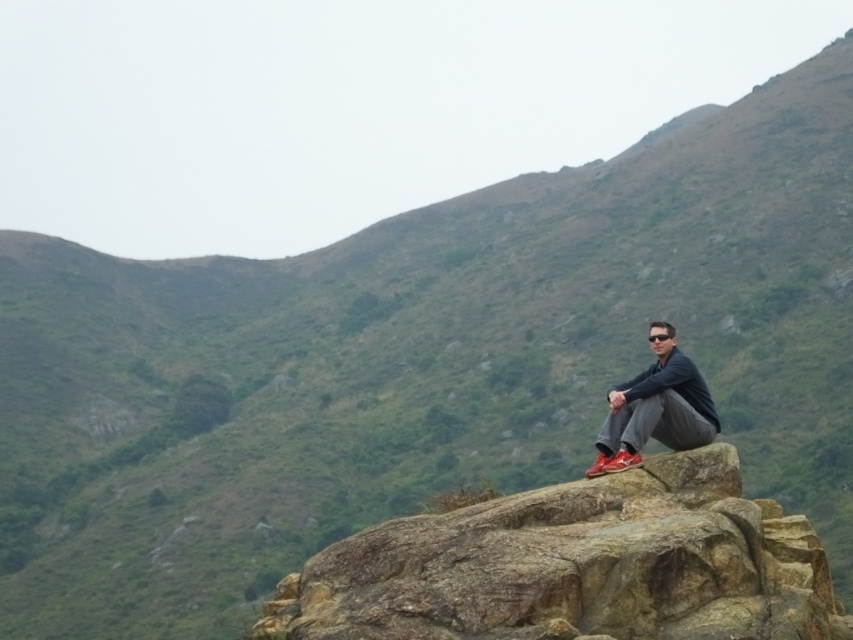
You are planning to place a matte black jacket at center on top of the brown rough rock at center. Based on their sizes, will the jacket fit entirely on the rock?

The brown rough rock at center might be wider than matte black jacket at center, so there is a possibility that the matte black jacket at center will fit entirely on the rock.

You are a photographer planning to take a portrait of the person in the scene. You want to ensure the matte black jacket at center is visible against the background. Given the position of the brown rough rock at center, where should you position the lighting to highlight the jacket?

Since the brown rough rock at center is below the matte black jacket at center, positioning the light source above the matte black jacket at center would cast a shadow downward onto the rock, creating contrast and making the jacket stand out against the background.

Based on the photo, you are standing at the point marked by the coordinates point (576, 566) in the image. What object are you standing on?

You are standing on the brown rough rock at center, as the coordinates point (576, 566) indicate this object.